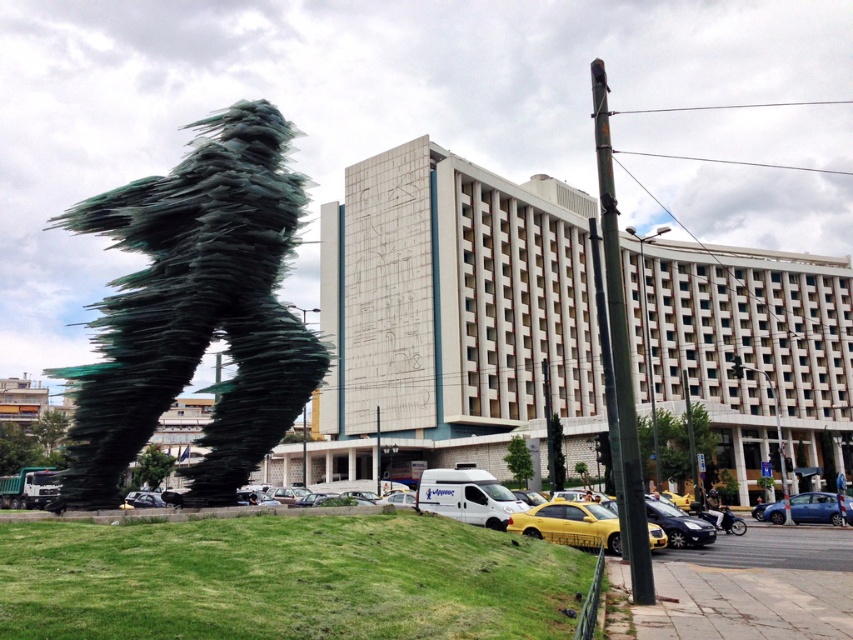
Question: Is yellow matte car at lower center positioned at the back of shiny black sedan at lower center?

Choices:
 (A) no
 (B) yes

Answer: (A)

Question: Considering the real-world distances, which object is farthest from the blue metallic car at lower right?

Choices:
 (A) yellow matte car at lower center
 (B) metallic silver car at lower left
 (C) green glass sculpture at left
 (D) green metallic pole at center

Answer: (C)

Question: Which point is farther to the camera?

Choices:
 (A) (540, 513)
 (B) (660, 513)
 (C) (144, 406)
 (D) (144, 502)

Answer: (D)

Question: Is green glass sculpture at left in front of green metallic pole at center?

Choices:
 (A) yes
 (B) no

Answer: (B)

Question: From the image, what is the correct spatial relationship of green glass sculpture at left in relation to shiny black sedan at lower center?

Choices:
 (A) right
 (B) left

Answer: (B)

Question: Which object is closer to the camera taking this photo?

Choices:
 (A) shiny black sedan at lower center
 (B) green metallic pole at center
 (C) metallic silver car at lower left

Answer: (B)